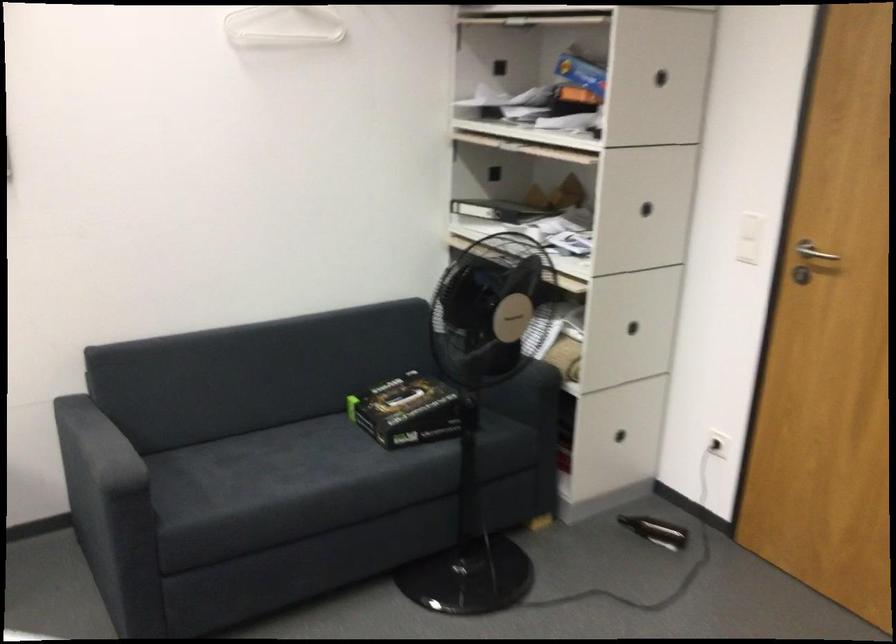
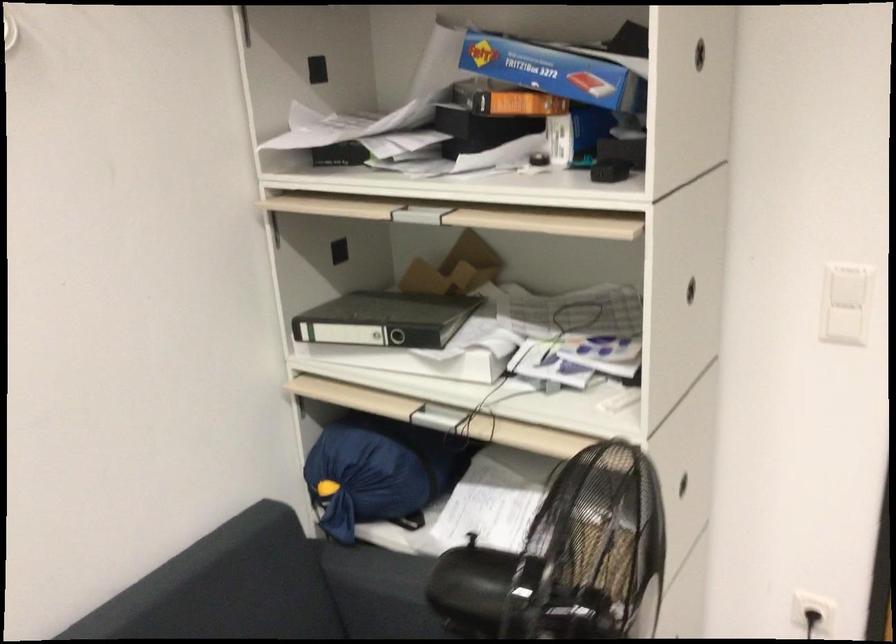
In the second image, find the point that corresponds to [600,128] in the first image.

(608, 171)